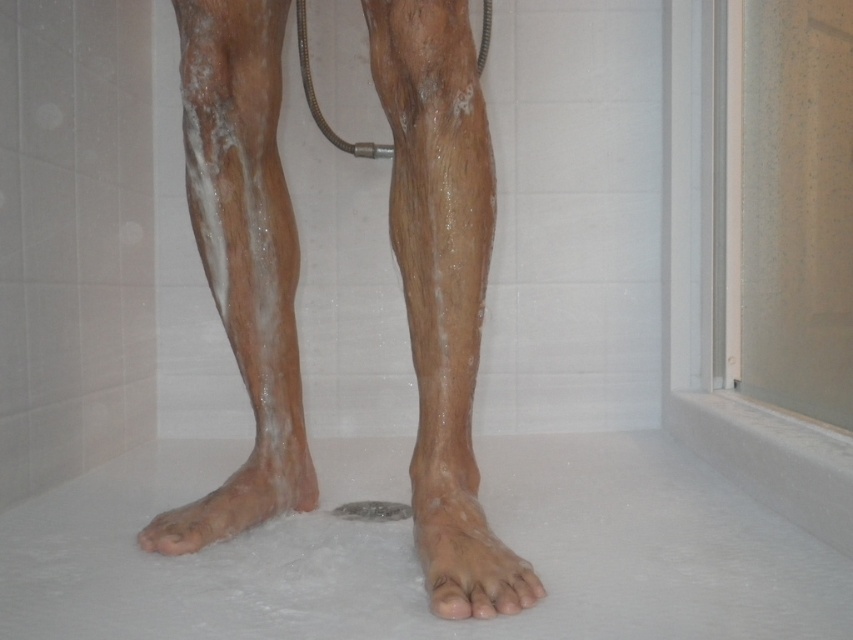
Which is behind, point (538, 593) or point (225, 500)?

The point (225, 500) is more distant.

Where is `slightly wet skin foot at lower center`? slightly wet skin foot at lower center is located at coordinates (465, 554).